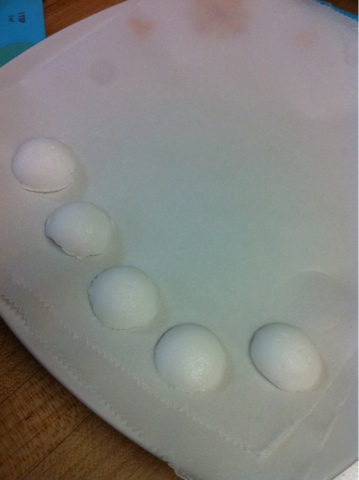
I want to click on table, so click(34, 419).